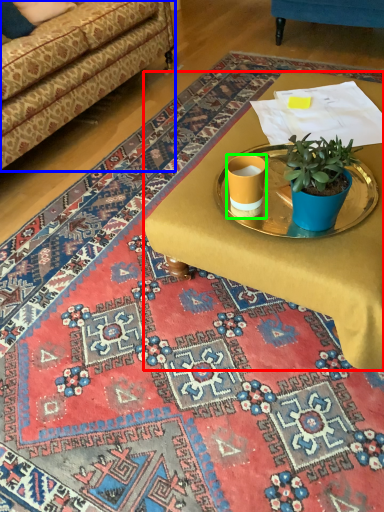
Question: Which is farther away from desk (highlighted by a red box)? studio couch (highlighted by a blue box) or coffee cup (highlighted by a green box)?

Choices:
 (A) studio couch
 (B) coffee cup

Answer: (A)